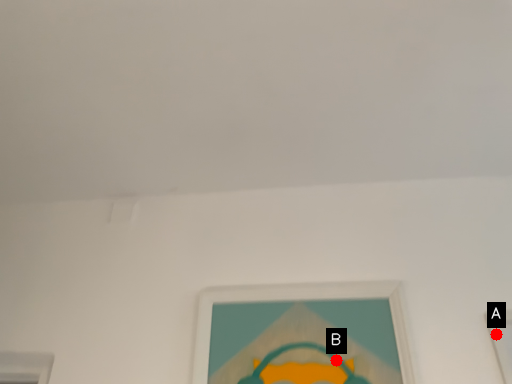
Question: Two points are circled on the image, labeled by A and B beside each circle. Which point appears closest to the camera in this image?

Choices:
 (A) A is closer
 (B) B is closer

Answer: (B)